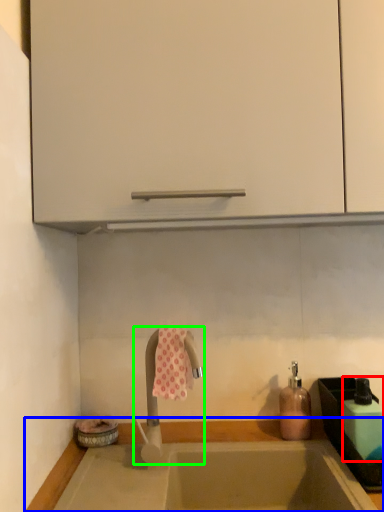
Question: Estimate the real-world distances between objects in this image. Which object is farther from bottle (highlighted by a red box), countertop (highlighted by a blue box) or tap (highlighted by a green box)?

Choices:
 (A) countertop
 (B) tap

Answer: (B)